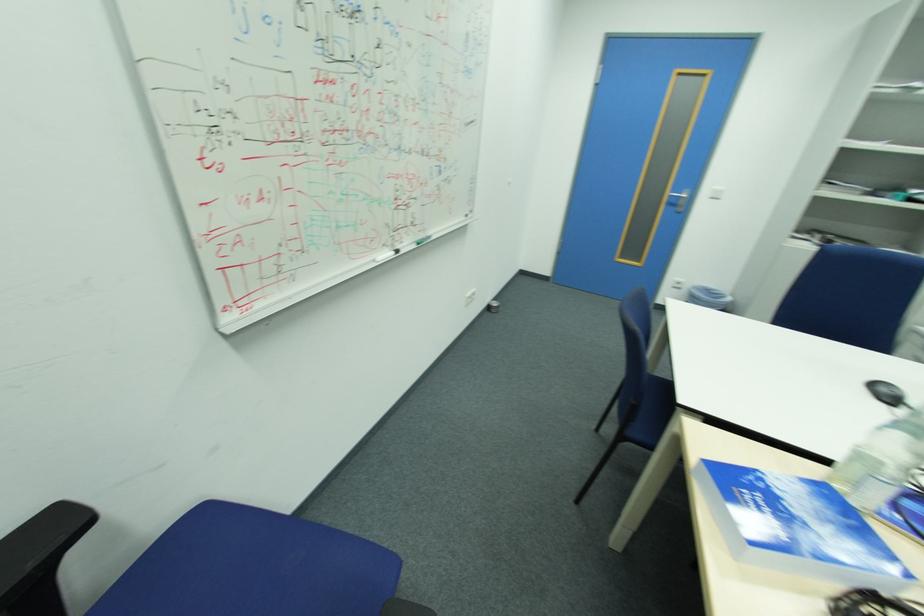
The width and height of the screenshot is (924, 616). I want to click on black chair armrest, so click(41, 543).